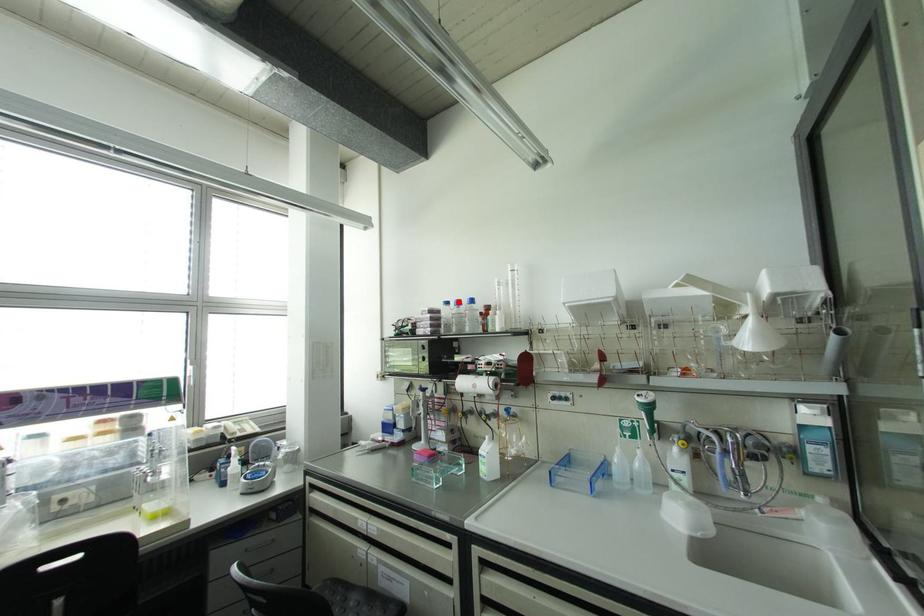
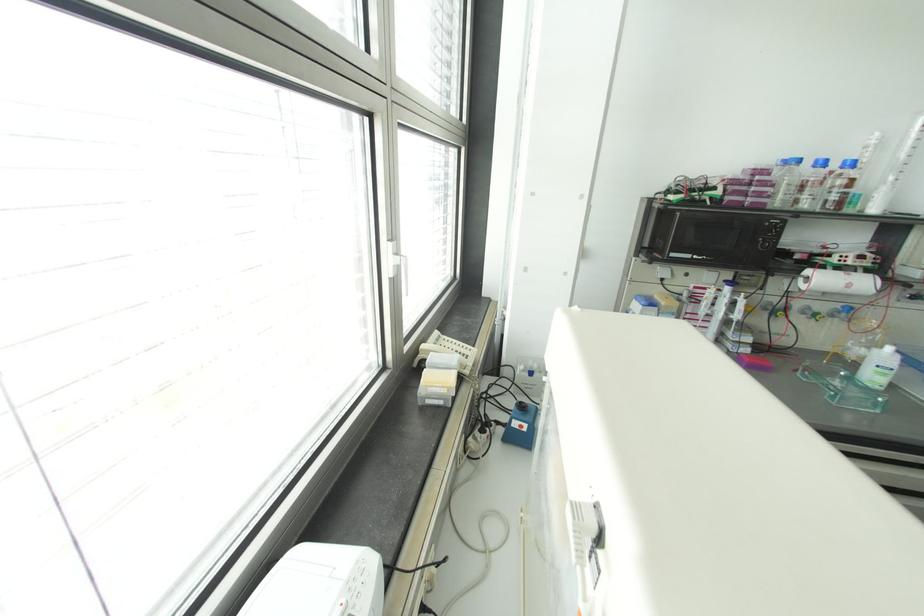
In the second image, find the point that corresponds to the highlighted location in the first image.

(822, 163)